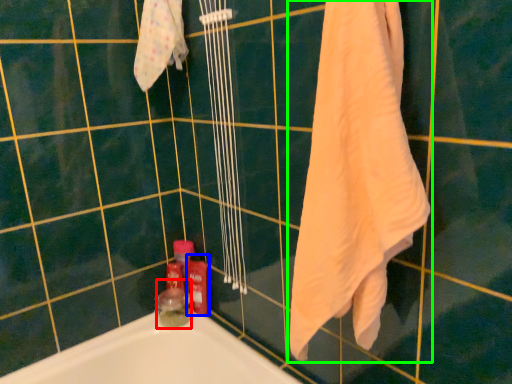
Question: Based on their relative distances, which object is farther from toiletry (highlighted by a red box)? Choose from cleaning product (highlighted by a blue box) and towel (highlighted by a green box).

Choices:
 (A) cleaning product
 (B) towel

Answer: (B)